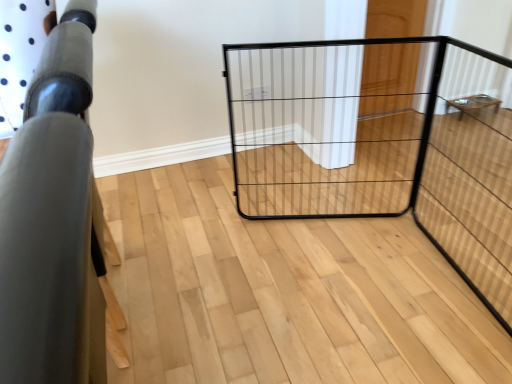
Question: From a real-world perspective, is wooden table at right, positioned as the second furniture in front-to-back order, on wooden door at upper right?

Choices:
 (A) yes
 (B) no

Answer: (B)

Question: Does wooden table at right, marked as the second furniture in a left-to-right arrangement, have a lesser width compared to wooden door at upper right?

Choices:
 (A) yes
 (B) no

Answer: (B)

Question: Is wooden table at right, the second furniture positioned from the bottom, directly adjacent to wooden door at upper right?

Choices:
 (A) no
 (B) yes

Answer: (A)

Question: From the image's perspective, is wooden table at right, positioned as the second furniture in front-to-back order, on top of wooden door at upper right?

Choices:
 (A) no
 (B) yes

Answer: (A)

Question: Is wooden table at right, the second furniture positioned from the bottom, far from wooden door at upper right?

Choices:
 (A) yes
 (B) no

Answer: (B)

Question: Is wooden table at right, positioned as the 1th furniture in back-to-front order, bigger than wooden door at upper right?

Choices:
 (A) yes
 (B) no

Answer: (B)

Question: Is matte black railing at left, the 1th furniture when ordered from bottom to top, closer to the viewer compared to black wire cage at center?

Choices:
 (A) yes
 (B) no

Answer: (A)

Question: Is matte black railing at left, the 1th furniture when ordered from bottom to top, not inside black wire cage at center?

Choices:
 (A) yes
 (B) no

Answer: (A)

Question: Does matte black railing at left, which appears as the second furniture when viewed from the top, turn towards black wire cage at center?

Choices:
 (A) no
 (B) yes

Answer: (A)

Question: From a real-world perspective, is matte black railing at left, the 1th furniture when ordered from bottom to top, on top of black wire cage at center?

Choices:
 (A) yes
 (B) no

Answer: (A)

Question: Considering the relative positions of matte black railing at left, which appears as the second furniture when viewed from the right, and black wire cage at center in the image provided, is matte black railing at left, which appears as the second furniture when viewed from the right, to the left of black wire cage at center from the viewer's perspective?

Choices:
 (A) no
 (B) yes

Answer: (B)

Question: Would you consider matte black railing at left, which ranks as the 1th furniture in front-to-back order, to be distant from black wire cage at center?

Choices:
 (A) yes
 (B) no

Answer: (A)

Question: Can you confirm if wooden table at right, marked as the first furniture in a right-to-left arrangement, is wider than black wire cage at center?

Choices:
 (A) no
 (B) yes

Answer: (B)